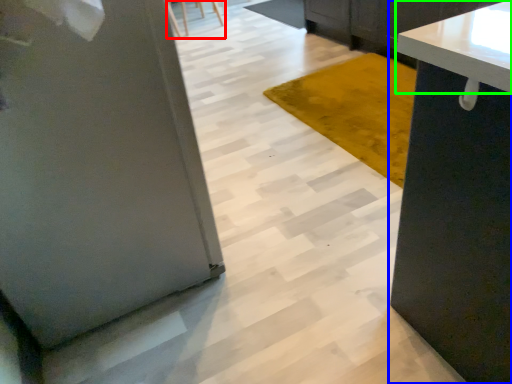
Question: Estimate the real-world distances between objects in this image. Which object is closer to chair (highlighted by a red box), cabinetry (highlighted by a blue box) or countertop (highlighted by a green box)?

Choices:
 (A) cabinetry
 (B) countertop

Answer: (B)